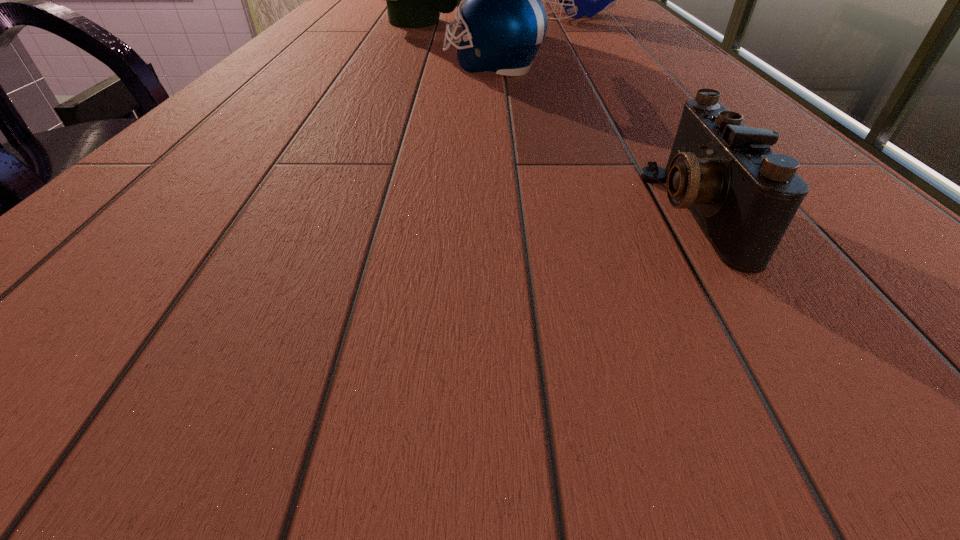
Identify which object is the closest to the nearest football helmet. Please provide its 2D coordinates. Your answer should be formatted as a tuple, i.e. [(x, y)], where the tuple contains the x and y coordinates of a point satisfying the conditions above.

[(414, 0)]

Select which object is the third closest to the shortest object. Please provide its 2D coordinates. Your answer should be formatted as a tuple, i.e. [(x, y)], where the tuple contains the x and y coordinates of a point satisfying the conditions above.

[(578, 0)]

This screenshot has height=540, width=960. Identify the location of the closest football helmet to the shortest football helmet. (414, 0).

You are a GUI agent. You are given a task and a screenshot of the screen. Output one action in this format:
    pyautogui.click(x=<x>, y=<y>)
    Task: Click on the football helmet that is the closest to the nearest football helmet
    The height and width of the screenshot is (540, 960).
    Given the screenshot: What is the action you would take?
    pyautogui.click(x=414, y=0)